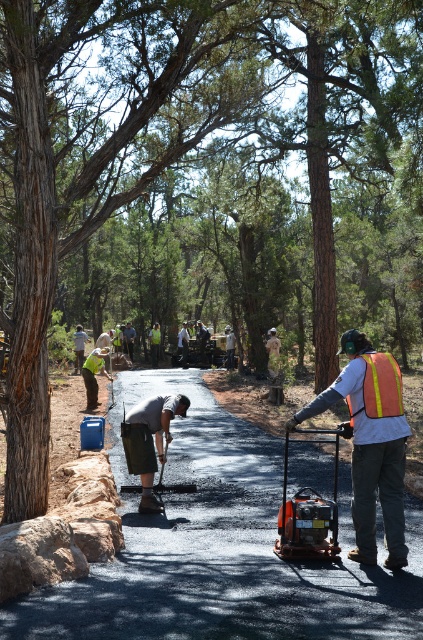
What do you see at coordinates (220, 548) in the screenshot? This screenshot has width=423, height=640. I see `black asphalt road at center` at bounding box center [220, 548].

Is point (115, 448) farther from viewer compared to point (368, 401)?

Yes, point (115, 448) is behind point (368, 401).

Find the location of a particular element. black asphalt road at center is located at coordinates (220, 548).

Which is behind, point (239, 552) or point (367, 390)?

Point (239, 552)

Is black asphalt road at center bigger than orange reflective safety vest at right?

Yes, black asphalt road at center is bigger than orange reflective safety vest at right.

Does point (200, 532) come in front of point (395, 369)?

No, it is behind (395, 369).

Find the location of `black asphalt road at center`. black asphalt road at center is located at coordinates (220, 548).

This screenshot has width=423, height=640. Find the location of `black asphalt road at center`. black asphalt road at center is located at coordinates (220, 548).

Between point (214, 493) and point (162, 417), which one is positioned behind?

Point (214, 493)

Locate an element on the screen. This screenshot has width=423, height=640. black asphalt road at center is located at coordinates (220, 548).